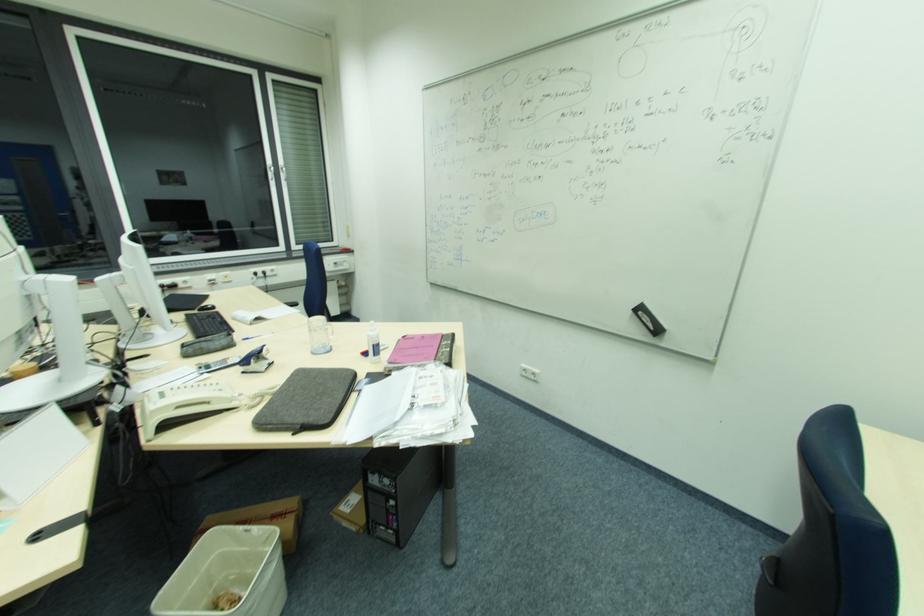
The image size is (924, 616). Describe the element at coordinates (184, 405) in the screenshot. I see `the white telephone handset` at that location.